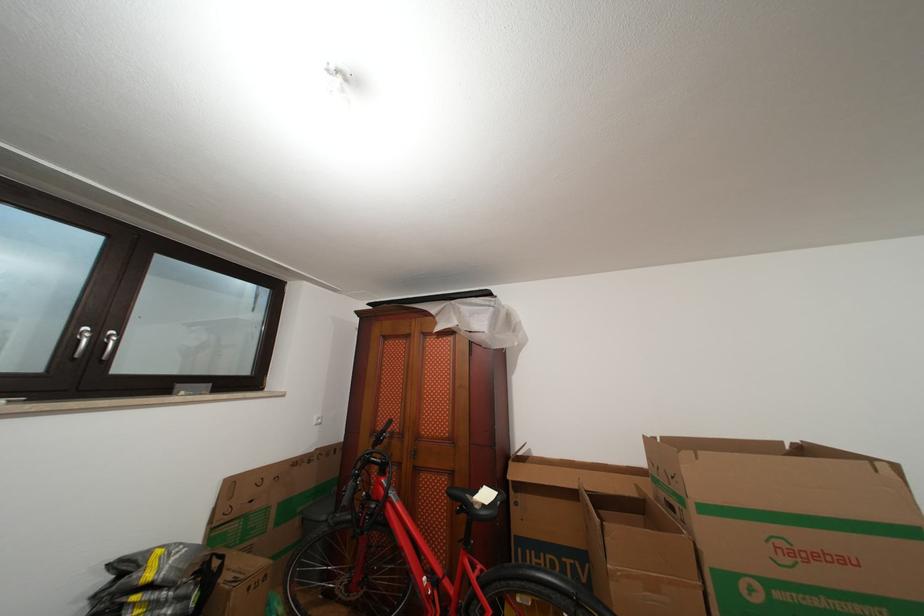
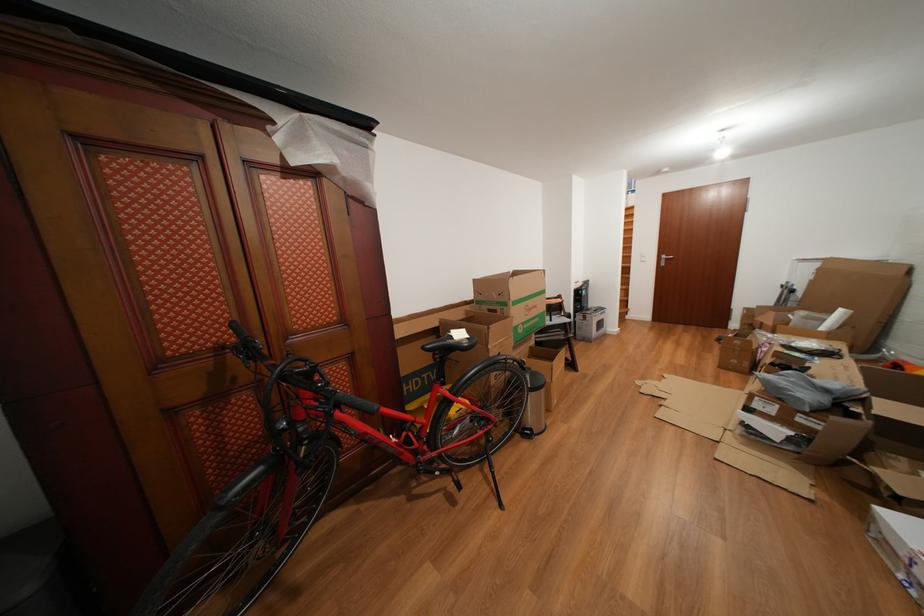
Where in the second image is the point corresponding to (x=398, y=427) from the first image?

(241, 330)